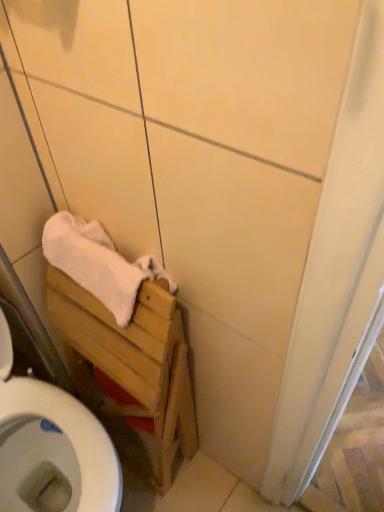
Locate an element on the screen. The image size is (384, 512). white cotton towel at lower left is located at coordinates (98, 263).

This screenshot has height=512, width=384. What do you see at coordinates (98, 263) in the screenshot?
I see `white cotton towel at lower left` at bounding box center [98, 263].

Locate an element on the screen. The height and width of the screenshot is (512, 384). white cotton towel at lower left is located at coordinates (98, 263).